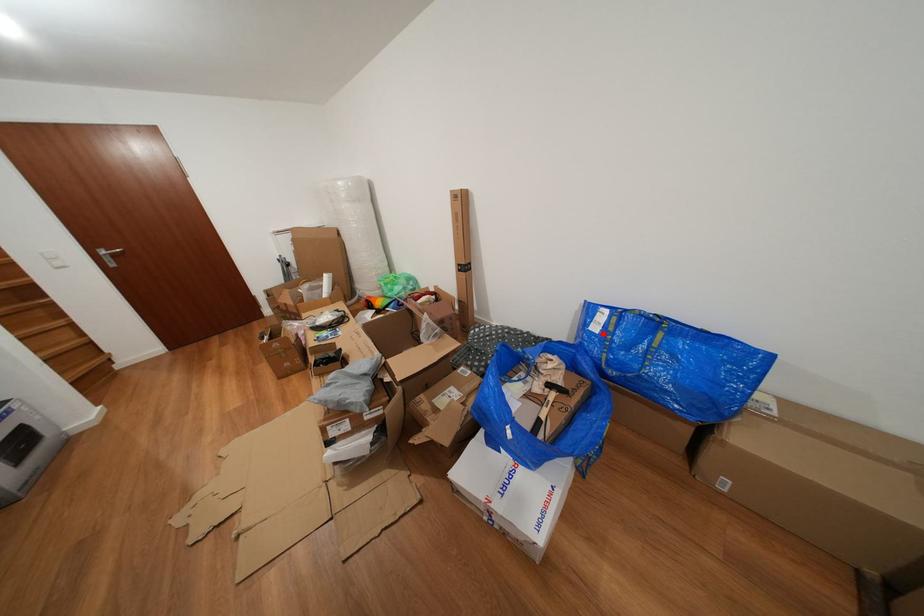
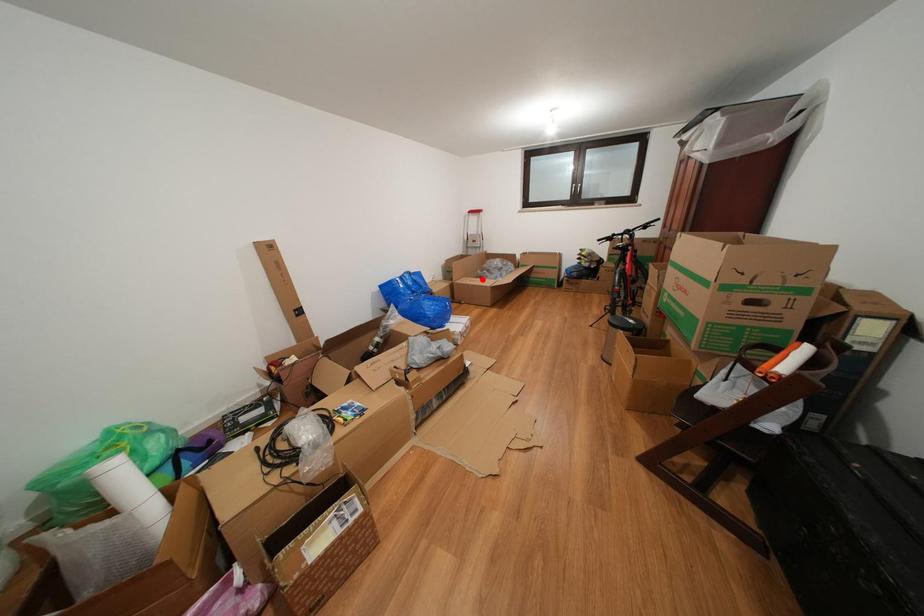
I am providing you with two images of the same scene from different viewpoints. A red point is marked on the first image and another point is marked on the second image. Are the points marked in image1 and image2 representing the same 3D position?

No